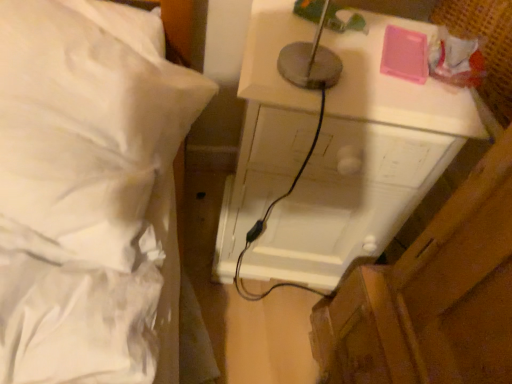
Identify the location of white glossy nightstand at upper right. This screenshot has height=384, width=512. (364, 164).

This screenshot has height=384, width=512. What do you see at coordinates (364, 164) in the screenshot?
I see `white glossy nightstand at upper right` at bounding box center [364, 164].

Describe the element at coordinates (89, 192) in the screenshot. I see `white soft bed at upper left` at that location.

I want to click on white soft bed at upper left, so click(89, 192).

The image size is (512, 384). I want to click on white glossy nightstand at upper right, so click(x=364, y=164).

Is white soft bed at upper left at the left side of white glossy nightstand at upper right?

Correct, you'll find white soft bed at upper left to the left of white glossy nightstand at upper right.

Which object is more forward, white soft bed at upper left or white glossy nightstand at upper right?

white soft bed at upper left is in front.

Is point (161, 167) farther from camera compared to point (362, 99)?

Yes.

From the image's perspective, between white soft bed at upper left and white glossy nightstand at upper right, who is located below?

white glossy nightstand at upper right appears lower in the image.

From a real-world perspective, which is physically above, white soft bed at upper left or white glossy nightstand at upper right?

From a 3D spatial view, white soft bed at upper left is above.

In terms of width, does white soft bed at upper left look wider or thinner when compared to white glossy nightstand at upper right?

white soft bed at upper left is wider than white glossy nightstand at upper right.

Consider the image. Can you confirm if white soft bed at upper left is taller than white glossy nightstand at upper right?

No.

Is white soft bed at upper left smaller than white glossy nightstand at upper right?

Correct, white soft bed at upper left occupies less space than white glossy nightstand at upper right.

Is white soft bed at upper left inside the boundaries of white glossy nightstand at upper right, or outside?

white soft bed at upper left is not enclosed by white glossy nightstand at upper right.

Is white soft bed at upper left far from white glossy nightstand at upper right?

white soft bed at upper left is near white glossy nightstand at upper right, not far away.

Does white soft bed at upper left turn towards white glossy nightstand at upper right?

No.

How many degrees apart are the facing directions of white soft bed at upper left and white glossy nightstand at upper right?

10.2 degrees.

How much distance is there between white soft bed at upper left and white glossy nightstand at upper right?

white soft bed at upper left is 12.00 inches away from white glossy nightstand at upper right.

Image resolution: width=512 pixels, height=384 pixels. I want to click on furniture behind the white soft bed at upper left, so click(364, 164).

Between white glossy nightstand at upper right and white soft bed at upper left, which one appears on the left side from the viewer's perspective?

white soft bed at upper left is more to the left.

Is white glossy nightstand at upper right positioned in front of white soft bed at upper left?

No, white glossy nightstand at upper right is further to the viewer.

Does point (301, 32) come in front of point (127, 301)?

No.

From the image's perspective, is white glossy nightstand at upper right beneath white soft bed at upper left?

Yes.

From a real-world perspective, is white glossy nightstand at upper right on top of white soft bed at upper left?

No, from a real-world perspective, white glossy nightstand at upper right is not above white soft bed at upper left.

Between white glossy nightstand at upper right and white soft bed at upper left, which one has larger width?

With larger width is white soft bed at upper left.

In the scene shown: Between white glossy nightstand at upper right and white soft bed at upper left, which one has more height?

white glossy nightstand at upper right.

Considering the sizes of objects white glossy nightstand at upper right and white soft bed at upper left in the image provided, who is bigger, white glossy nightstand at upper right or white soft bed at upper left?

Bigger between the two is white glossy nightstand at upper right.

Would you say white glossy nightstand at upper right is outside white soft bed at upper left?

white glossy nightstand at upper right lies outside white soft bed at upper left's area.

Is white glossy nightstand at upper right with white soft bed at upper left?

No, white glossy nightstand at upper right is not beside white soft bed at upper left.

Is white glossy nightstand at upper right oriented towards white soft bed at upper left?

No, white glossy nightstand at upper right is not oriented towards white soft bed at upper left.

At what (x,y) coordinates should I click in order to perform the action: click on furniture lying on the right of white soft bed at upper left. Please return your answer as a coordinate pair (x, y). This screenshot has width=512, height=384. Looking at the image, I should click on (364, 164).

I want to click on furniture below the white soft bed at upper left (from a real-world perspective), so click(x=364, y=164).

Image resolution: width=512 pixels, height=384 pixels. I want to click on bed in front of the white glossy nightstand at upper right, so click(x=89, y=192).